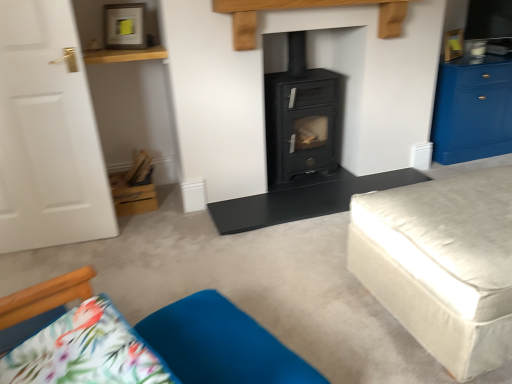
This screenshot has height=384, width=512. In order to click on space that is in front of black matte table at center in this screenshot , I will do `click(286, 274)`.